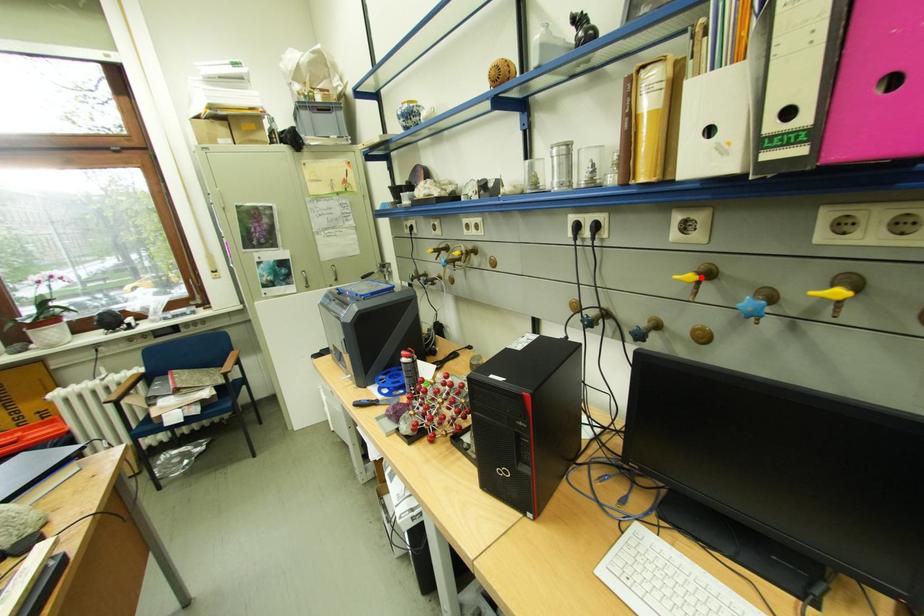
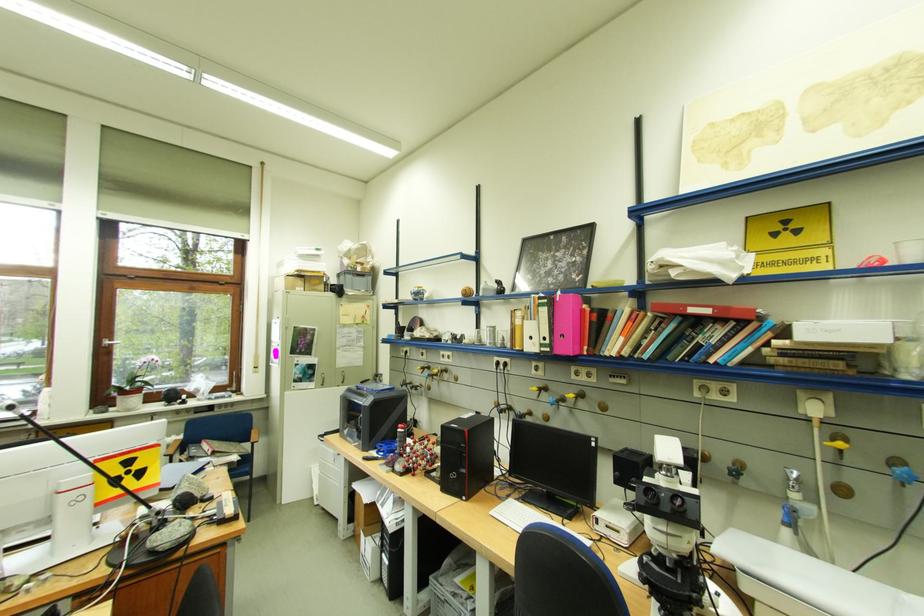
The point at the highlighted location is marked in the first image. Where is the corresponding point in the second image?

(544, 390)